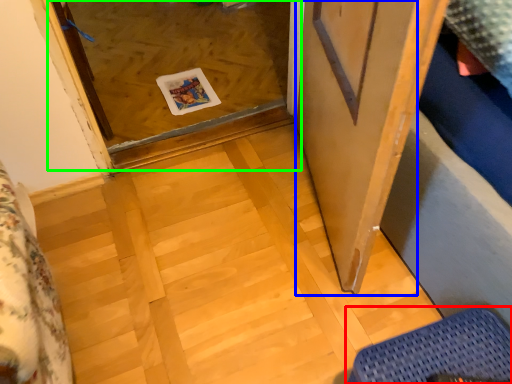
Question: Which is farther away from furniture (highlighted by a red box)? screen door (highlighted by a blue box) or glass door (highlighted by a green box)?

Choices:
 (A) screen door
 (B) glass door

Answer: (B)